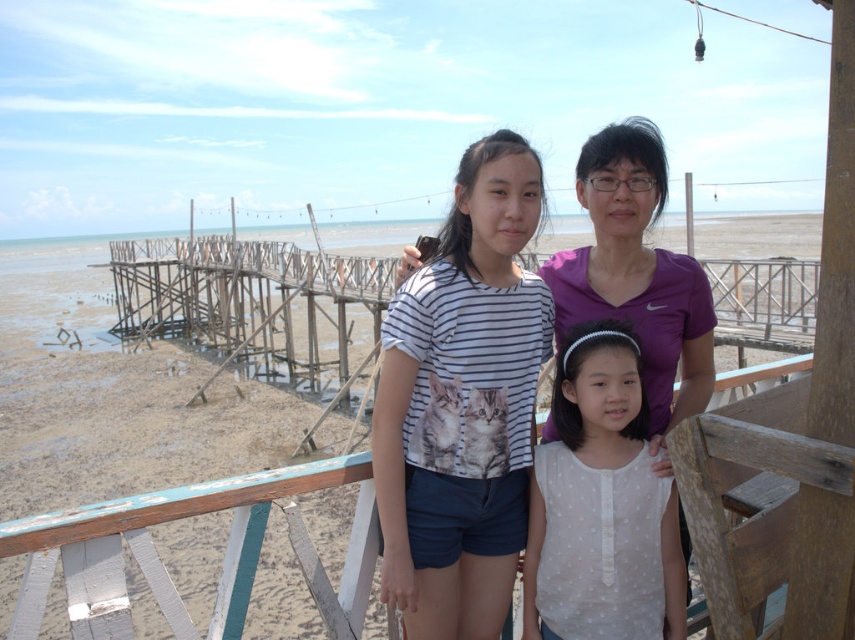
Question: Which point is farther to the camera?

Choices:
 (A) (503, 518)
 (B) (643, 250)
 (C) (606, 355)
 (D) (204, 545)

Answer: (D)

Question: Considering the relative positions of wooden pier at center and white striped shirt at center in the image provided, where is wooden pier at center located with respect to white striped shirt at center?

Choices:
 (A) left
 (B) right

Answer: (A)

Question: Among these objects, which one is farthest from the camera?

Choices:
 (A) wooden pier at center
 (B) white dotted blouse at center
 (C) purple matte shirt at center
 (D) white striped shirt at center

Answer: (B)

Question: Can you confirm if wooden pier at center is positioned below white striped shirt at center?

Choices:
 (A) no
 (B) yes

Answer: (A)

Question: Which point is farther from the camera taking this photo?

Choices:
 (A) (169, 540)
 (B) (671, 348)

Answer: (A)

Question: Observing the image, what is the correct spatial positioning of white striped shirt at center in reference to purple matte shirt at center?

Choices:
 (A) below
 (B) above

Answer: (A)